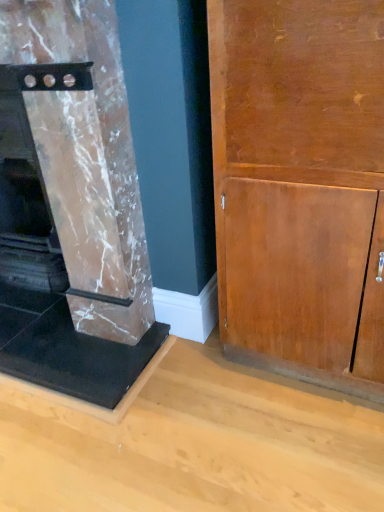
Where is `blank space to the left of wooden cabinet at right`? blank space to the left of wooden cabinet at right is located at coordinates (192, 398).